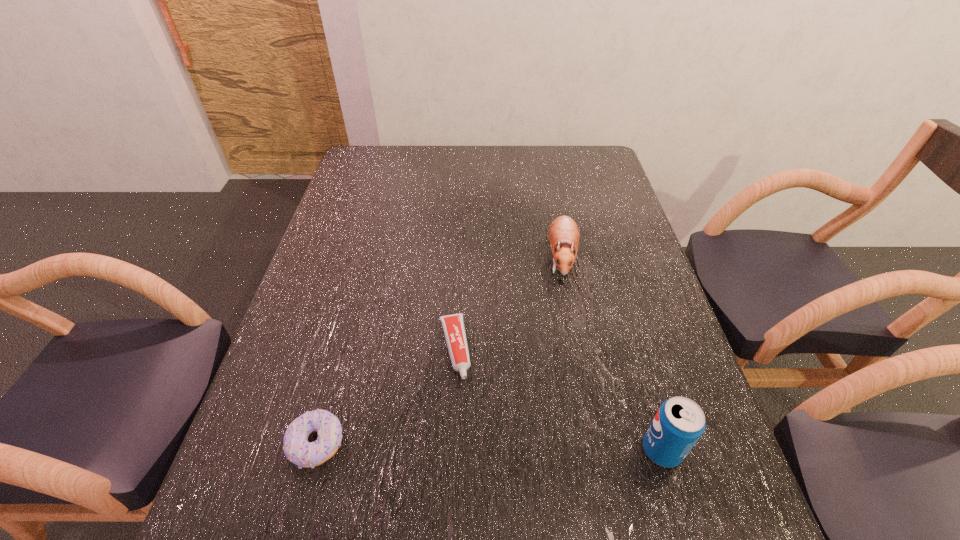
Locate an element on the screen. The width and height of the screenshot is (960, 540). blank region between the soda can and the third tallest object is located at coordinates (490, 447).

Locate an element on the screen. vacant area between the leftmost object and the second farthest object is located at coordinates (386, 396).

Locate an element on the screen. Image resolution: width=960 pixels, height=540 pixels. vacant point located between the shortest object and the soda can is located at coordinates (558, 399).

The width and height of the screenshot is (960, 540). In order to click on free space that is in between the leftmost object and the third object from left to right in this screenshot , I will do `click(439, 350)`.

The width and height of the screenshot is (960, 540). What are the coordinates of `empty space between the soda can and the toothpaste` in the screenshot? It's located at (558, 399).

The image size is (960, 540). In order to click on vacant area between the soda can and the doughnut in this screenshot , I will do `click(490, 447)`.

The width and height of the screenshot is (960, 540). I want to click on free space between the second tallest object and the third nearest object, so click(x=508, y=303).

Identify the location of object that is the second nearest to the toothpaste. (563, 233).

You are a GUI agent. You are given a task and a screenshot of the screen. Output one action in this format:
    pyautogui.click(x=<x>, y=<y>)
    Task: Click on the closest object to the shortest object
    The height and width of the screenshot is (540, 960).
    Given the screenshot: What is the action you would take?
    pyautogui.click(x=297, y=449)